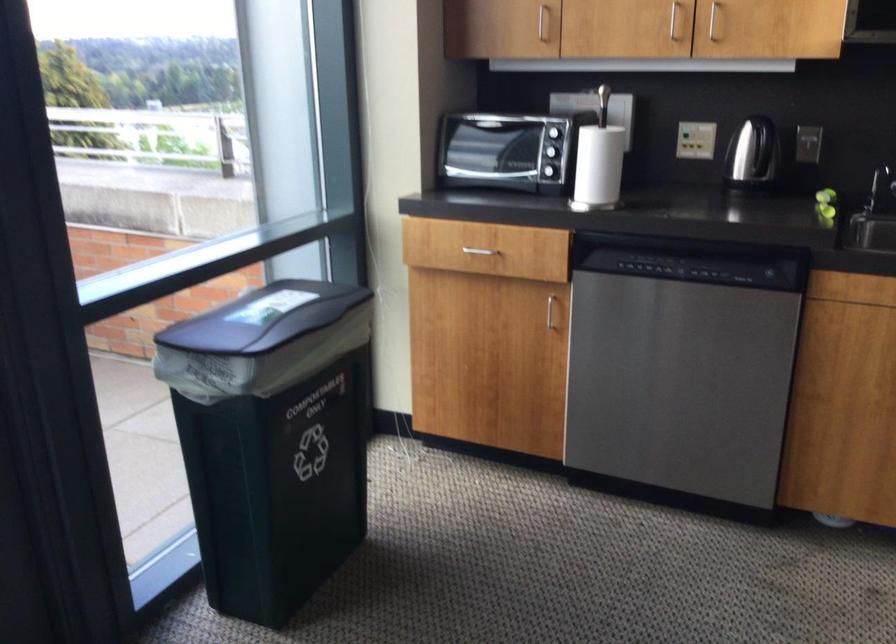
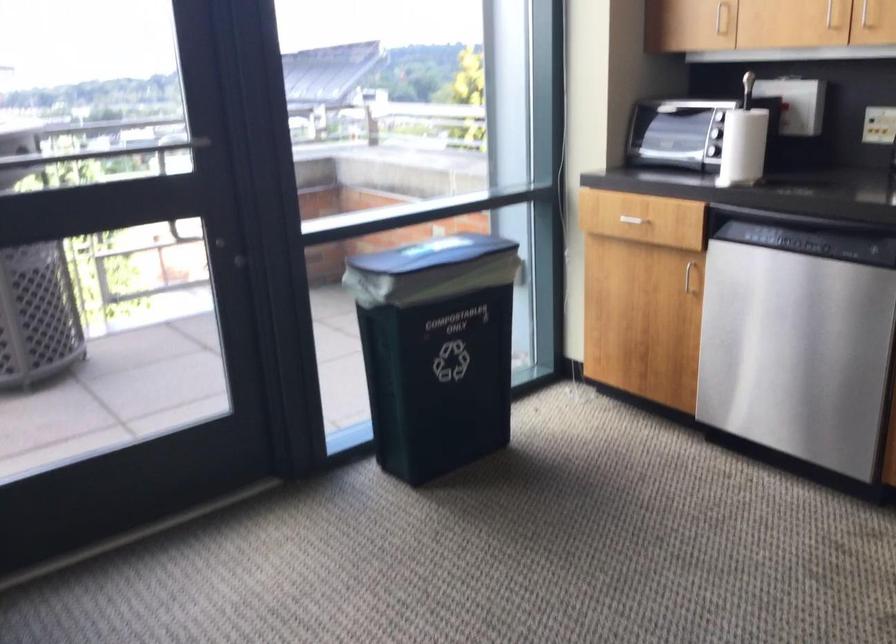
The point at (549,310) is marked in the first image. Where is the corresponding point in the second image?

(690, 276)